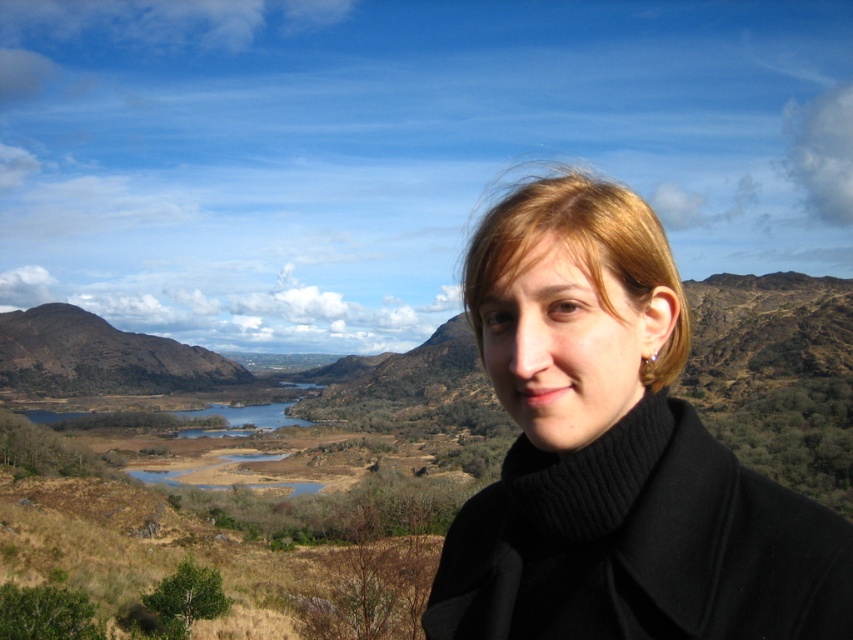
You are an outdoor photographer trying to capture the scene with the black woolen coat at right and the brown textured mountain at left. Based on their positions, which object is closer to the camera?

The black woolen coat at right is closer to the camera because it is positioned to the right of the brown textured mountain at left in the scene.

You are a photographer trying to capture the black woolen coat at right in your shot. The camera is set to focus on the point at coordinates point (614, 452). Will the black woolen coat at right be in focus?

Yes, the black woolen coat at right is located exactly at point (614, 452), so it will be in focus.

You are a photographer trying to capture the person in the black woolen coat at right and the brown textured mountain at left in the same frame. Based on their sizes in the image, which object appears larger?

The brown textured mountain at left appears larger than the black woolen coat at right because the coat is not as tall as the mountain.